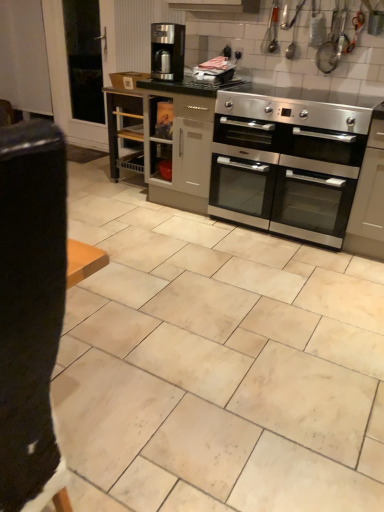
What is the approximate width of beige matte tile at center?

3.70 meters.

Locate an element on the screen. satin black coffee maker at center is located at coordinates (167, 51).

This screenshot has width=384, height=512. Describe the element at coordinates (177, 140) in the screenshot. I see `satin grey cabinet at center` at that location.

In order to face stainless steel oven at center, should I rotate leftwards or rightwards?

You should rotate right by 14.191 degrees.

You are a GUI agent. You are given a task and a screenshot of the screen. Output one action in this format:
    pyautogui.click(x=<x>, y=<y>)
    Task: Click on the stainless steel oven at center
    
    Given the screenshot: What is the action you would take?
    (286, 176)

From the picture: Could satin black coffee maker at center be considered to be inside stainless steel oven at center?

No, satin black coffee maker at center is not inside stainless steel oven at center.

Would you say stainless steel oven at center is a long distance from satin black coffee maker at center?

Actually, stainless steel oven at center and satin black coffee maker at center are a little close together.

Which of these two, stainless steel oven at center or satin black coffee maker at center, is smaller?

satin black coffee maker at center is smaller.

Can you confirm if stainless steel oven at center is positioned to the right of satin black coffee maker at center?

Indeed, stainless steel oven at center is positioned on the right side of satin black coffee maker at center.

Can we say transparent glass door at upper left lies outside stainless steel oven at center?

Yes.

Is transparent glass door at upper left to the left of stainless steel oven at center from the viewer's perspective?

Yes.

Is stainless steel oven at center at the back of transparent glass door at upper left?

No, transparent glass door at upper left's orientation is not away from stainless steel oven at center.

Is transparent glass door at upper left not close to stainless steel oven at center?

transparent glass door at upper left is positioned a significant distance from stainless steel oven at center.

Between beige matte tile at center and stainless steel oven at center, which one has larger size?

Bigger between the two is beige matte tile at center.

From a real-world perspective, is beige matte tile at center above or below stainless steel oven at center?

Clearly, from a real-world perspective, beige matte tile at center is below stainless steel oven at center.

Image resolution: width=384 pixels, height=512 pixels. Identify the location of oven behind the beige matte tile at center. (286, 176).

What's the angular difference between beige matte tile at center and stainless steel oven at center's facing directions?

There is a 90.3-degree angle between the facing directions of beige matte tile at center and stainless steel oven at center.

Is stainless steel oven at center oriented towards transparent glass door at upper left?

No, stainless steel oven at center is not oriented towards transparent glass door at upper left.

From a real-world perspective, is stainless steel oven at center on transparent glass door at upper left?

Yes, from a real-world perspective, stainless steel oven at center is on top of transparent glass door at upper left.

Is stainless steel oven at center placed right next to transparent glass door at upper left?

No, stainless steel oven at center is not touching transparent glass door at upper left.

Can you confirm if stainless steel oven at center is bigger than transparent glass door at upper left?

No, stainless steel oven at center is not bigger than transparent glass door at upper left.

From a real-world perspective, is stainless steel oven at center physically located above or below satin grey cabinet at center?

stainless steel oven at center is situated higher than satin grey cabinet at center in the real world.

Does stainless steel oven at center have a lesser height compared to satin grey cabinet at center?

Yes.

How different are the orientations of stainless steel oven at center and satin grey cabinet at center in degrees?

There is a 0.112-degree angle between the facing directions of stainless steel oven at center and satin grey cabinet at center.

Does beige matte tile at center touch stainless steel oven at center?

No, beige matte tile at center is not in contact with stainless steel oven at center.

Considering the relative positions of beige matte tile at center and stainless steel oven at center in the image provided, is beige matte tile at center behind stainless steel oven at center?

That is False.

Choose the correct answer: Is beige matte tile at center inside stainless steel oven at center or outside it?

beige matte tile at center lies outside stainless steel oven at center.

Could you tell me if beige matte tile at center is turned towards stainless steel oven at center?

No, beige matte tile at center is not facing towards stainless steel oven at center.

Is satin black coffee maker at center thinner than stainless steel oven at center?

Correct, the width of satin black coffee maker at center is less than that of stainless steel oven at center.

From the image's perspective, is satin black coffee maker at center positioned above or below stainless steel oven at center?

Based on their image positions, satin black coffee maker at center is located above stainless steel oven at center.

Locate an element on the screen. oven in front of the satin black coffee maker at center is located at coordinates (286, 176).

Between point (176, 59) and point (307, 142), which one is positioned behind?

The point (176, 59) is behind.

This screenshot has height=512, width=384. I want to click on gas stove that is on the right side of satin black coffee maker at center, so click(298, 106).

The height and width of the screenshot is (512, 384). I want to click on gas stove below the transparent glass door at upper left (from the image's perspective), so click(298, 106).

When comparing their distances from transparent glass door at upper left, does stainless steel oven at center or beige matte tile at center seem further?

beige matte tile at center lies further to transparent glass door at upper left than the other object.

When comparing their distances from transparent glass door at upper left, does beige matte tile at center or stainless steel oven at center seem closer?

Among the two, stainless steel oven at center is located nearer to transparent glass door at upper left.

When comparing their distances from stainless steel oven at center, does beige matte tile at center or transparent glass door at upper left seem closer?

beige matte tile at center.

Estimate the real-world distances between objects in this image. Which object is closer to stainless steel oven at center, beige matte tile at center or stainless steel oven at center?

Among the two, stainless steel oven at center is located nearer to stainless steel oven at center.

From the image, which object appears to be nearer to transparent glass door at upper left, satin black coffee maker at center or stainless steel oven at center?

The object closer to transparent glass door at upper left is satin black coffee maker at center.

Looking at the image, which one is located further to satin black coffee maker at center, transparent glass door at upper left or satin grey cabinet at center?

transparent glass door at upper left is further to satin black coffee maker at center.

Looking at the image, which one is located closer to beige matte tile at center, stainless steel oven at center or stainless steel oven at center?

stainless steel oven at center is positioned closer to the anchor beige matte tile at center.

From the image, which object appears to be nearer to satin grey cabinet at center, beige matte tile at center or transparent glass door at upper left?

beige matte tile at center is positioned closer to the anchor satin grey cabinet at center.

The width and height of the screenshot is (384, 512). In order to click on cabinetry located between transparent glass door at upper left and stainless steel oven at center in the left-right direction in this screenshot , I will do `click(177, 140)`.

Where is `oven situated between satin grey cabinet at center and stainless steel oven at center from left to right`? This screenshot has width=384, height=512. oven situated between satin grey cabinet at center and stainless steel oven at center from left to right is located at coordinates (286, 176).

Where is `coffee maker between transparent glass door at upper left and stainless steel oven at center from left to right`? coffee maker between transparent glass door at upper left and stainless steel oven at center from left to right is located at coordinates (167, 51).

The height and width of the screenshot is (512, 384). What are the coordinates of `oven between beige matte tile at center and satin grey cabinet at center in the front-back direction` in the screenshot? It's located at (286, 176).